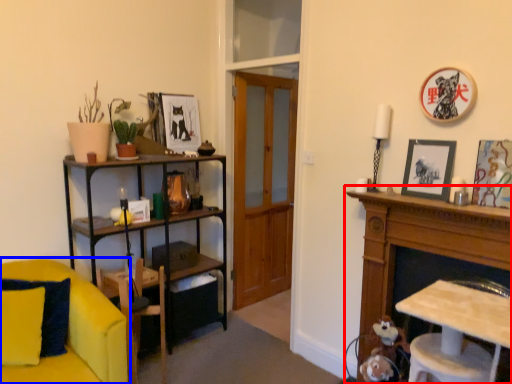
Question: Which of the following is the closest to the observer, cabinetry (highlighted by a red box) or chair (highlighted by a blue box)?

Choices:
 (A) cabinetry
 (B) chair

Answer: (A)